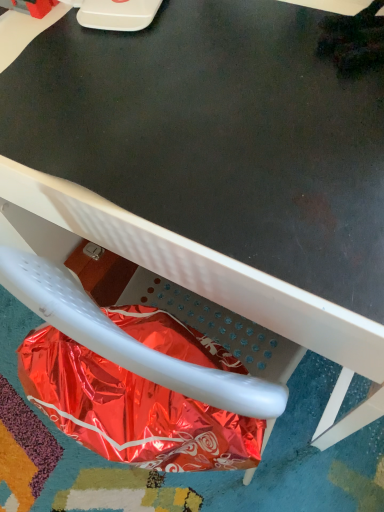
Question: Is the position of shiny metallic bag at lower left less distant than that of metallic white chair at lower center?

Choices:
 (A) yes
 (B) no

Answer: (B)

Question: Does shiny metallic bag at lower left have a smaller size compared to metallic white chair at lower center?

Choices:
 (A) yes
 (B) no

Answer: (A)

Question: Does shiny metallic bag at lower left have a greater width compared to metallic white chair at lower center?

Choices:
 (A) yes
 (B) no

Answer: (B)

Question: Considering the relative sizes of shiny metallic bag at lower left and metallic white chair at lower center in the image provided, is shiny metallic bag at lower left taller than metallic white chair at lower center?

Choices:
 (A) no
 (B) yes

Answer: (A)

Question: Does shiny metallic bag at lower left turn towards metallic white chair at lower center?

Choices:
 (A) yes
 (B) no

Answer: (B)

Question: From a real-world perspective, is shiny metallic bag at lower left on top of metallic white chair at lower center?

Choices:
 (A) yes
 (B) no

Answer: (A)

Question: Could you tell me if metallic white chair at lower center is turned towards shiny metallic bag at lower left?

Choices:
 (A) no
 (B) yes

Answer: (A)

Question: From a real-world perspective, is metallic white chair at lower center located beneath shiny metallic bag at lower left?

Choices:
 (A) yes
 (B) no

Answer: (A)

Question: Is metallic white chair at lower center wider than shiny metallic bag at lower left?

Choices:
 (A) yes
 (B) no

Answer: (A)

Question: Does metallic white chair at lower center appear on the right side of shiny metallic bag at lower left?

Choices:
 (A) no
 (B) yes

Answer: (B)

Question: Is metallic white chair at lower center smaller than shiny metallic bag at lower left?

Choices:
 (A) yes
 (B) no

Answer: (B)

Question: Is metallic white chair at lower center facing away from shiny metallic bag at lower left?

Choices:
 (A) no
 (B) yes

Answer: (B)

Question: In terms of size, does metallic white chair at lower center appear bigger or smaller than shiny metallic bag at lower left?

Choices:
 (A) small
 (B) big

Answer: (B)